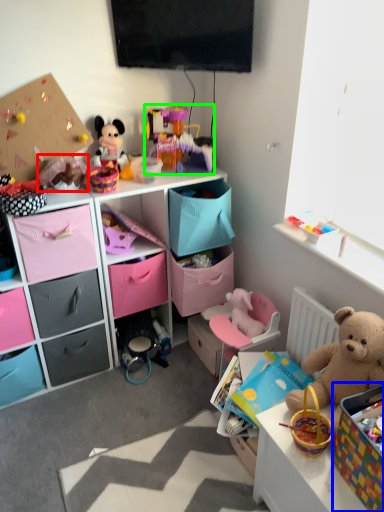
Question: Which object is positioned farthest from toy (highlighted by a red box)? Select from storage box (highlighted by a blue box) and toy (highlighted by a green box).

Choices:
 (A) storage box
 (B) toy

Answer: (A)